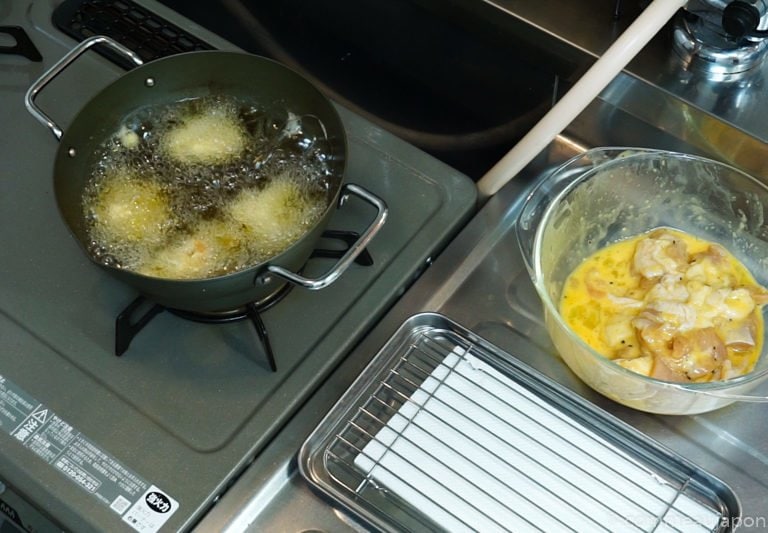
At what (x,y) coordinates should I click in order to perform the action: click on right burner. Please return your answer as a coordinate pair (x, y). The image size is (768, 533). Looking at the image, I should click on click(x=130, y=330).